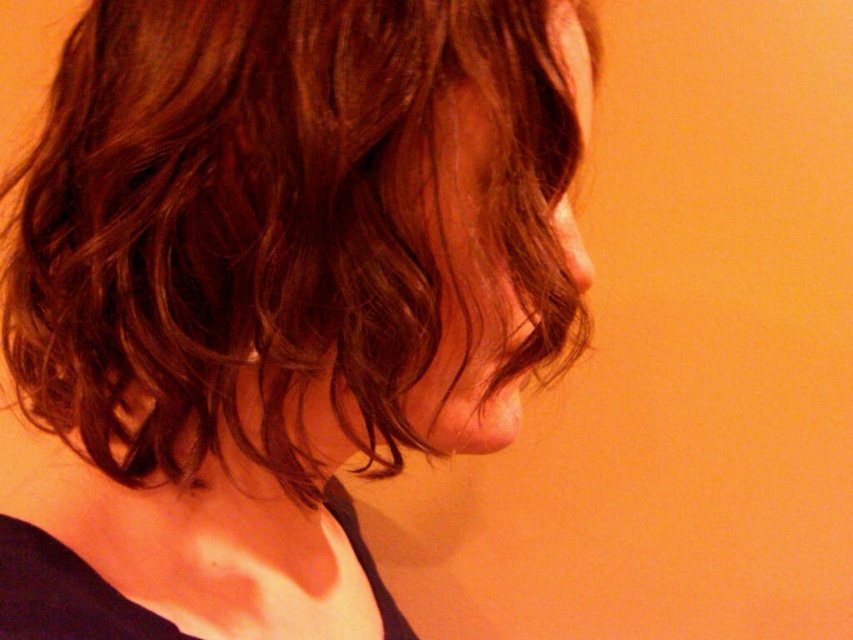
Question: Is brown wavy hair at center wider than shiny brown hair at center?

Choices:
 (A) no
 (B) yes

Answer: (B)

Question: Which of the following is the closest to the observer?

Choices:
 (A) (386, 435)
 (B) (479, 257)

Answer: (B)

Question: Is brown wavy hair at center closer to camera compared to shiny brown hair at center?

Choices:
 (A) no
 (B) yes

Answer: (B)

Question: Can you confirm if brown wavy hair at center is positioned above shiny brown hair at center?

Choices:
 (A) yes
 (B) no

Answer: (B)